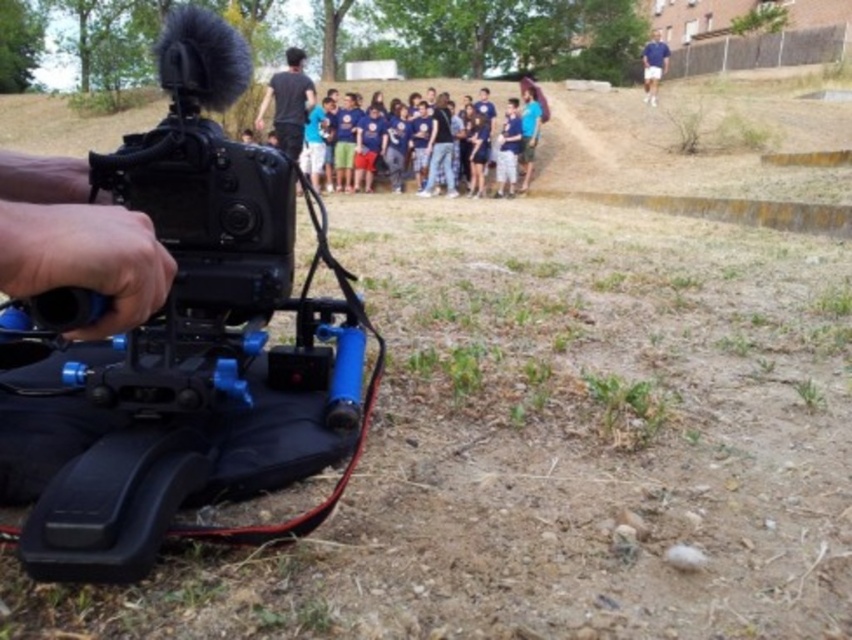
Question: Which point is farther to the camera?

Choices:
 (A) black plastic video camera at left
 (B) blue cotton shirt at upper right
 (C) blue cotton shirt at center

Answer: (B)

Question: Which point is closer to the camera taking this photo?

Choices:
 (A) (494, 132)
 (B) (235, 204)
 (C) (645, 49)

Answer: (B)

Question: Observing the image, what is the correct spatial positioning of black plastic video camera at left in reference to blue cotton shirt at upper right?

Choices:
 (A) right
 (B) left

Answer: (B)

Question: Is black plastic video camera at left below blue cotton shirt at upper right?

Choices:
 (A) no
 (B) yes

Answer: (B)

Question: Is black plastic video camera at left wider than blue cotton shirt at center?

Choices:
 (A) yes
 (B) no

Answer: (B)

Question: Which of the following is the farthest from the observer?

Choices:
 (A) click(660, 76)
 (B) click(304, 355)
 (C) click(533, 120)

Answer: (A)